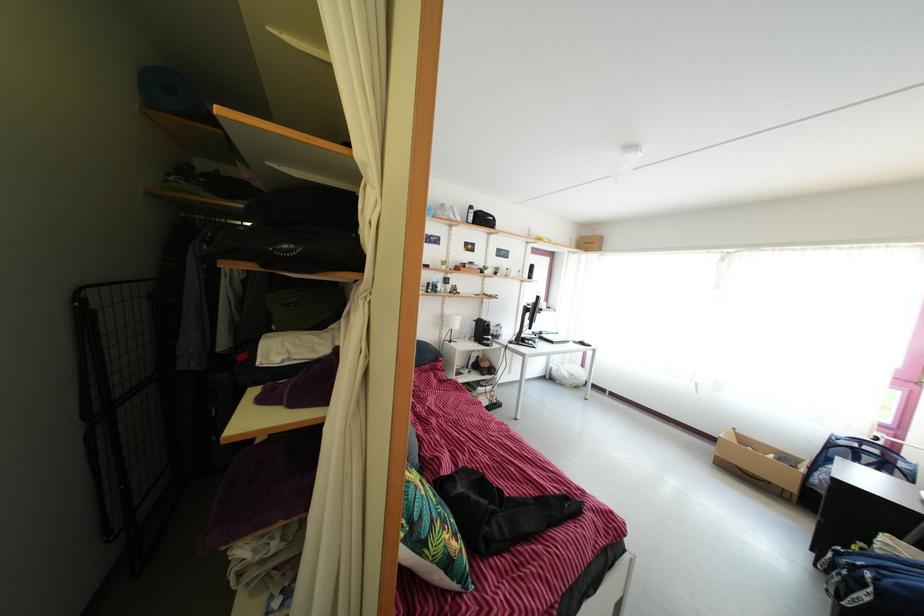
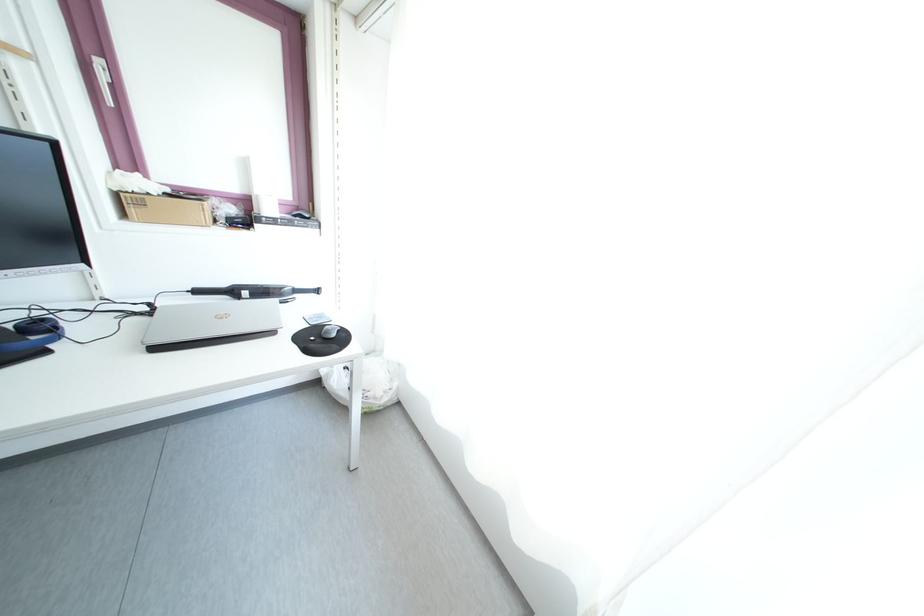
Locate, in the second image, the point that corresponds to the point at 570,386 in the first image.

(344, 403)